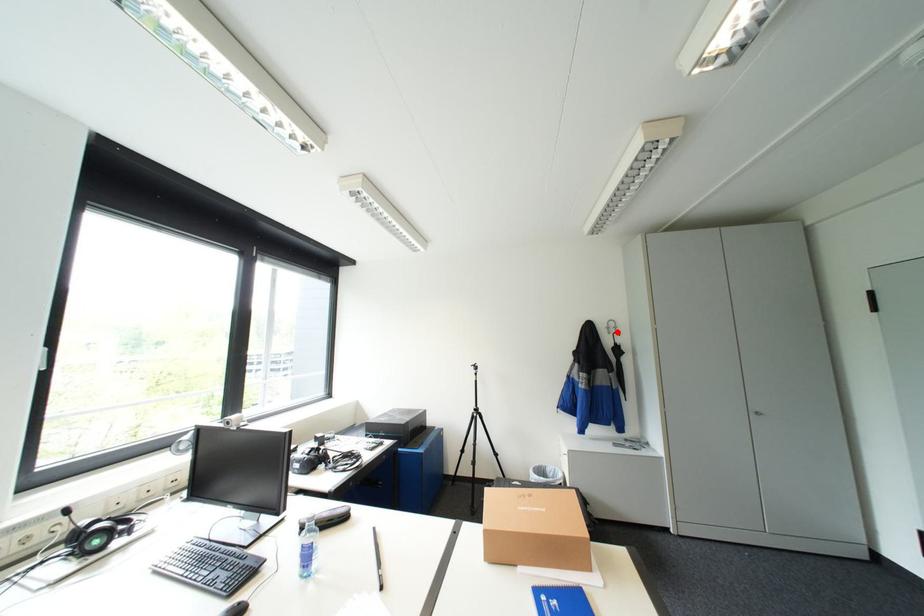
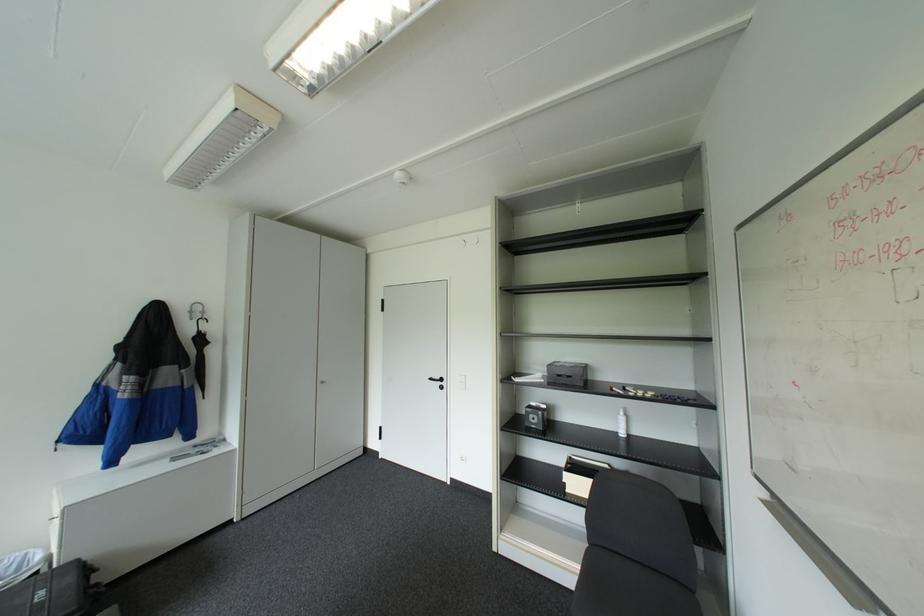
Find the pixel in the second image that matches the highlighted location in the first image.

(200, 318)